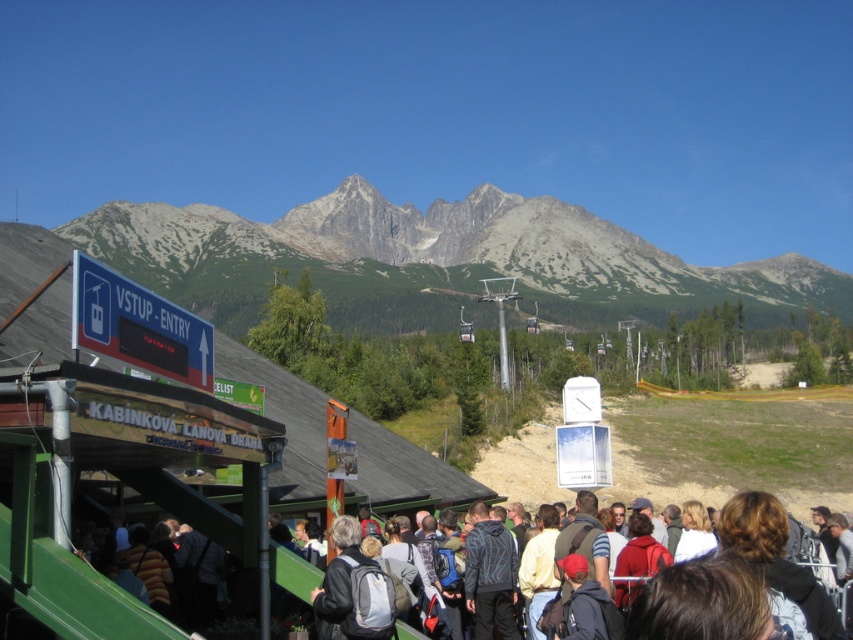
Question: Among these objects, which one is nearest to the camera?

Choices:
 (A) gray rocky mountain at upper center
 (B) green metal ski resort at center

Answer: (B)

Question: From the image, what is the correct spatial relationship of gray rocky mountain at upper center in relation to dark gray backpack at center?

Choices:
 (A) above
 (B) below

Answer: (A)

Question: Which point appears farthest from the camera in this image?

Choices:
 (A) (187, 275)
 (B) (283, 502)
 (C) (757, 545)

Answer: (A)

Question: Is gray rocky mountain at upper center bigger than green metal ski resort at center?

Choices:
 (A) yes
 (B) no

Answer: (A)

Question: Can you confirm if gray rocky mountain at upper center is smaller than green metal ski resort at center?

Choices:
 (A) yes
 (B) no

Answer: (B)

Question: Which point is closer to the camera taking this photo?

Choices:
 (A) (466, 216)
 (B) (27, 260)
 (C) (769, 525)

Answer: (C)